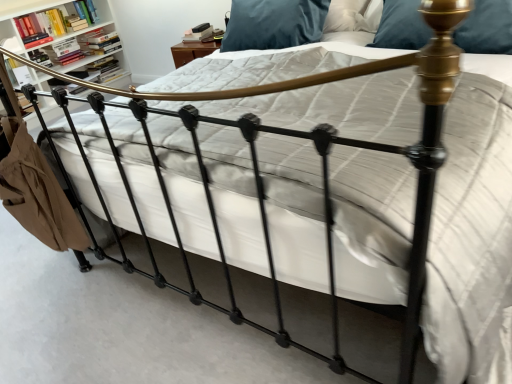
Question: In the image, is hardcover books at upper left, placed as the fourth book when sorted from front to back, on the left side or the right side of hardcover book at upper left, which is the 3th book in back-to-front order?

Choices:
 (A) right
 (B) left

Answer: (A)

Question: Is point (103, 66) positioned closer to the camera than point (66, 51)?

Choices:
 (A) closer
 (B) farther

Answer: (B)

Question: Which object is positioned farthest from the hardcover book at upper left, which is the 3th book in back-to-front order?

Choices:
 (A) hardcover book at upper left, the 3th book from the front
 (B) velvet blue pillow at upper right
 (C) hardcover book at upper left, the 4th book when ordered from back to front
 (D) hardcover books at upper left, which is counted as the 1th book, starting from the back
 (E) metallic bookshelf at upper left

Answer: (B)

Question: Which of these objects is positioned farthest from the hardcover book at upper left, the first book viewed from the front?

Choices:
 (A) velvet blue pillow at upper right
 (B) hardcover book at upper left, marked as the 2th book in a front-to-back arrangement
 (C) metallic bookshelf at upper left
 (D) hardcover book at upper left, which is the 2th book in back-to-front order
 (E) hardcover books at upper left, placed as the fourth book when sorted from front to back

Answer: (A)